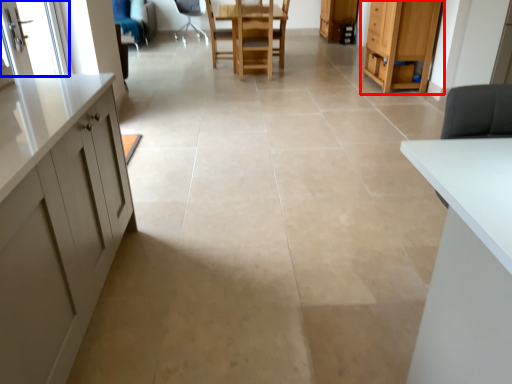
Question: Which of the following is the closest to the observer, cabinetry (highlighted by a red box) or screen door (highlighted by a blue box)?

Choices:
 (A) cabinetry
 (B) screen door

Answer: (B)